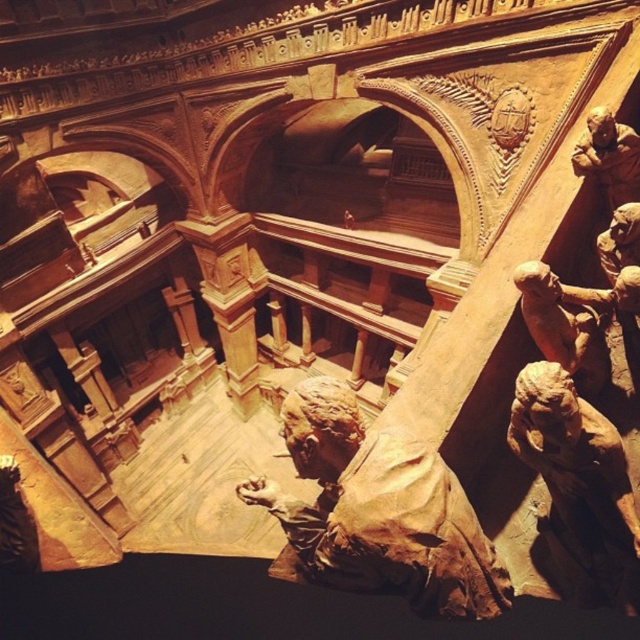
In the scene shown: You are an architect examining the image of the classical building. You notice a point marked at coordinates (378, 513). Based on the scene description, which object does this point most likely correspond to?

The point at coordinates (378, 513) corresponds to the brown clay figure at center.

You are an art conservator examining the architectural scene. You need to move a protective cover from the matte brown statue at lower right to the brown clay figure at upper right. Which direction should you move the cover relative to the statue?

The matte brown statue at lower right is to the left of the brown clay figure at upper right, so you should move the protective cover to the right to position it over the brown clay figure at upper right.